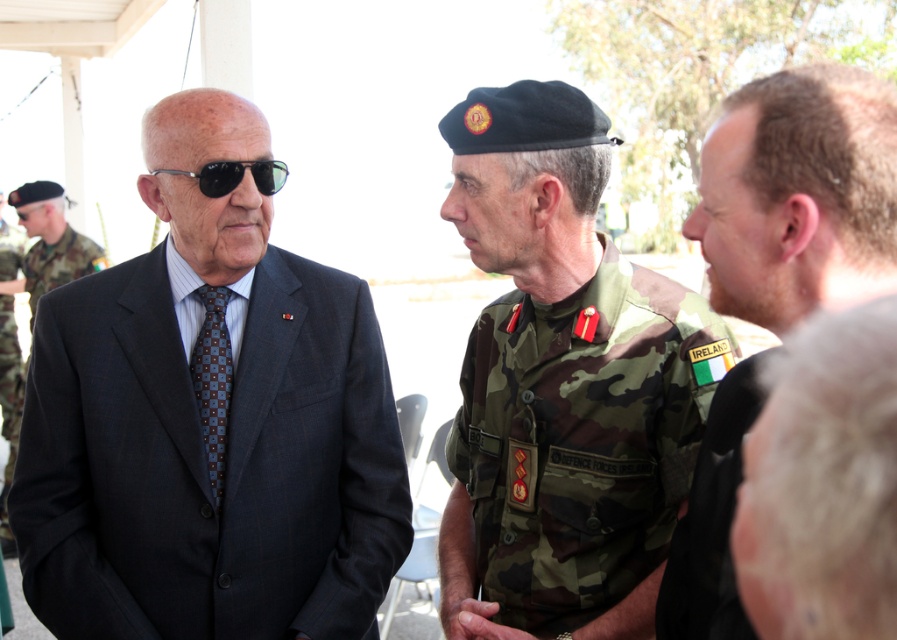
You are a photographer at this event and need to capture a photo of the matte black suit at left and the camouflage uniform at center. To ensure both are in frame, should you adjust your camera to focus on the left or the right side more?

The matte black suit at left is positioned on the left side of the camouflage uniform at center, so to include both in the frame, focus the camera towards the left side where the matte black suit at left is located to ensure both are captured.

You are standing in the outdoor event area and want to approach the matte black suit at left and the black reflective sunglasses at left. Which one should you walk towards first to reach the closer object?

You should walk towards the matte black suit at left first because it is closer to you than the black reflective sunglasses at left, which is further away.

You are a photographer at this event and need to capture a group photo of the camouflage fabric military uniform at center and the camouflage uniform at left. The camera you have can only focus on objects within a 1.5 meter width. Can both uniforms fit within the camera frame?

The camouflage fabric military uniform at center is narrower than the camouflage uniform at left. Since the camera can focus on objects within 1.5 meters, and the combined width of both uniforms is less than 1.5 meters, both uniforms can fit within the camera frame.